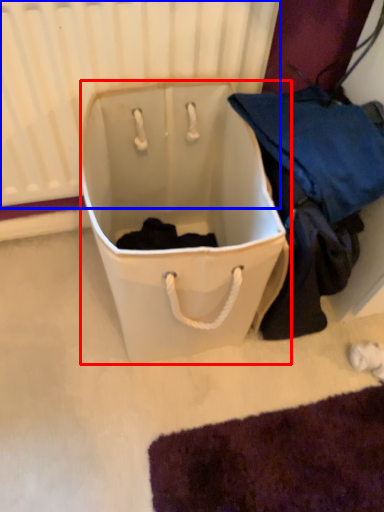
Question: Which of the following is the farthest to the observer, luggage and bags (highlighted by a red box) or radiator (highlighted by a blue box)?

Choices:
 (A) luggage and bags
 (B) radiator

Answer: (B)